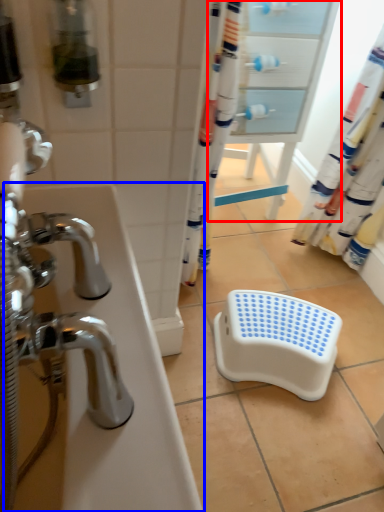
Question: Which point is closer to the camera, screen door (highlighted by a red box) or bath (highlighted by a blue box)?

Choices:
 (A) screen door
 (B) bath

Answer: (B)